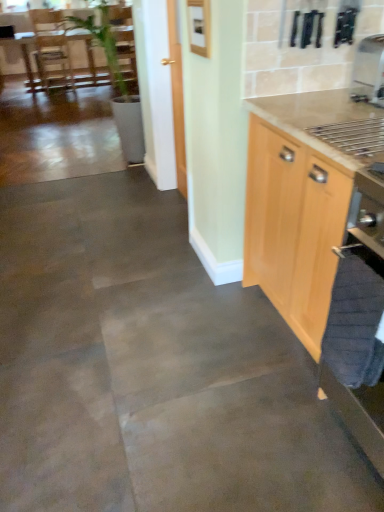
Question: From a real-world perspective, is brown wooden table at upper left physically below satin silver coffee machine at upper right?

Choices:
 (A) yes
 (B) no

Answer: (A)

Question: Is brown wooden table at upper left positioned in front of satin silver coffee machine at upper right?

Choices:
 (A) yes
 (B) no

Answer: (B)

Question: Considering the relative sizes of brown wooden table at upper left and satin silver coffee machine at upper right in the image provided, is brown wooden table at upper left shorter than satin silver coffee machine at upper right?

Choices:
 (A) yes
 (B) no

Answer: (B)

Question: Is brown wooden table at upper left touching satin silver coffee machine at upper right?

Choices:
 (A) no
 (B) yes

Answer: (A)

Question: From the image's perspective, is brown wooden table at upper left below satin silver coffee machine at upper right?

Choices:
 (A) yes
 (B) no

Answer: (B)

Question: From the image's perspective, is light wood cabinet at right positioned above or below brown wooden table at upper left?

Choices:
 (A) above
 (B) below

Answer: (B)

Question: In terms of width, does light wood cabinet at right look wider or thinner when compared to brown wooden table at upper left?

Choices:
 (A) wide
 (B) thin

Answer: (B)

Question: Is light wood cabinet at right to the left or to the right of brown wooden table at upper left in the image?

Choices:
 (A) right
 (B) left

Answer: (A)

Question: Is light wood cabinet at right in front of or behind brown wooden table at upper left in the image?

Choices:
 (A) front
 (B) behind

Answer: (A)

Question: From a real-world perspective, relative to satin silver coffee machine at upper right, is light wood cabinet at right vertically above or below?

Choices:
 (A) below
 (B) above

Answer: (A)

Question: Would you say light wood cabinet at right is inside or outside satin silver coffee machine at upper right?

Choices:
 (A) outside
 (B) inside

Answer: (A)

Question: Does point (251, 234) appear closer or farther from the camera than point (380, 33)?

Choices:
 (A) closer
 (B) farther

Answer: (B)

Question: From the image's perspective, is light wood cabinet at right positioned above or below satin silver coffee machine at upper right?

Choices:
 (A) above
 (B) below

Answer: (B)

Question: Based on their sizes in the image, would you say satin silver coffee machine at upper right is bigger or smaller than light wood cabinet at right?

Choices:
 (A) small
 (B) big

Answer: (A)

Question: Is point (380, 73) positioned closer to the camera than point (289, 219)?

Choices:
 (A) closer
 (B) farther

Answer: (B)